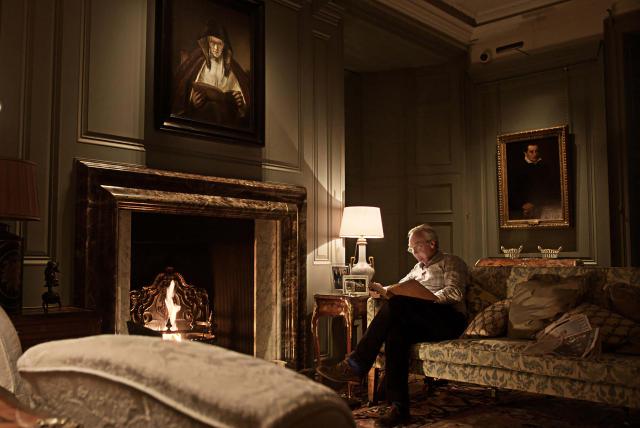
What are the coordinates of `painting` in the screenshot? It's located at (528, 164), (208, 69).